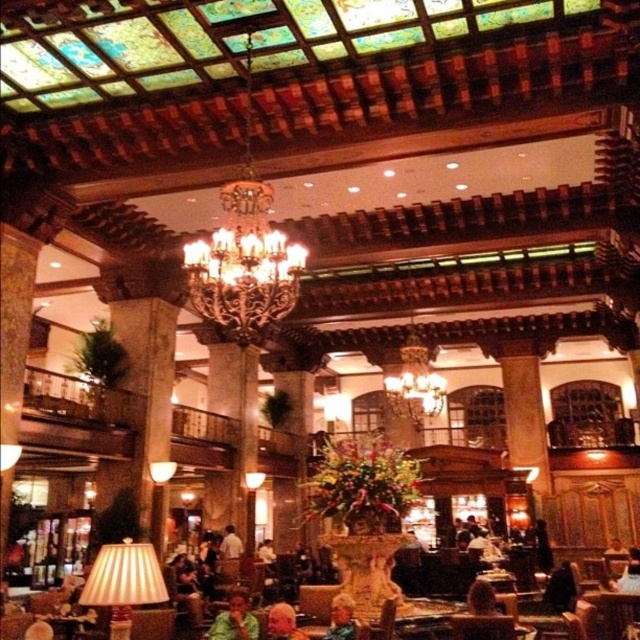
You are standing in the grand lobby and want to move from the point at coordinates point (x=221, y=620) to the point at coordinates point (x=488, y=586). Which direction should you move to get closer to your destination?

To move from point (x=221, y=620) to point (x=488, y=586), you should move upward because point (x=221, y=620) is in front of point (x=488, y=586), indicating it is closer to the viewer and you need to go towards the back of the space to reach the destination.

You are standing in the grand lobby and need to reach the dark brown leather chair at center. You have a dark brown leather jacket at lower right that you want to bring with you. Can you carry the jacket while walking to the chair without dropping it?

The dark brown leather jacket at lower right is 4.63 meters away from dark brown leather chair at center. Since the distance is manageable, you can carry the jacket while walking to the chair without dropping it.